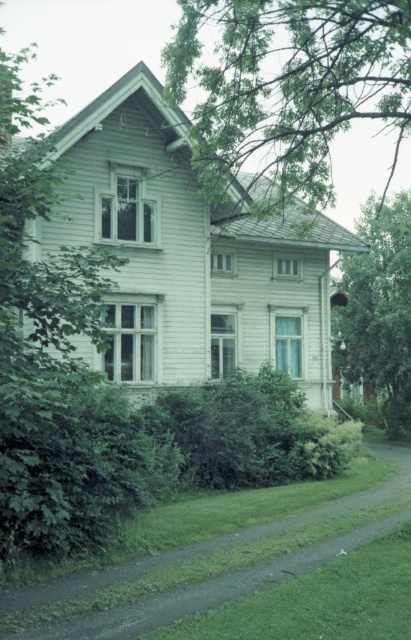
Question: Which is farther from the green leafy tree at upper center?

Choices:
 (A) green leafy tree at right
 (B) green grassy driveway at lower center

Answer: (B)

Question: Among these objects, which one is nearest to the camera?

Choices:
 (A) green leafy tree at right
 (B) green grassy driveway at lower center

Answer: (B)

Question: Is green leafy tree at upper center wider than green leafy tree at right?

Choices:
 (A) no
 (B) yes

Answer: (B)

Question: Which object is positioned closest to the green leafy tree at right?

Choices:
 (A) green leafy tree at upper center
 (B) green grassy driveway at lower center

Answer: (A)

Question: Observing the image, what is the correct spatial positioning of green grassy driveway at lower center in reference to green leafy tree at right?

Choices:
 (A) above
 (B) below

Answer: (B)

Question: Does green grassy driveway at lower center have a larger size compared to green leafy tree at right?

Choices:
 (A) yes
 (B) no

Answer: (B)